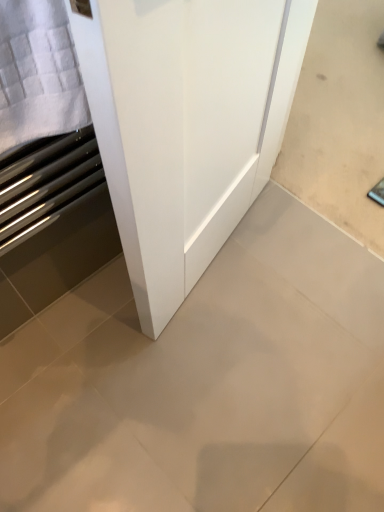
Question: From a real-world perspective, is white textured towel at left below matte gray tile at center?

Choices:
 (A) yes
 (B) no

Answer: (B)

Question: Is white textured towel at left positioned with its back to matte gray tile at center?

Choices:
 (A) yes
 (B) no

Answer: (B)

Question: Is white textured towel at left beside matte gray tile at center?

Choices:
 (A) no
 (B) yes

Answer: (A)

Question: Can you confirm if white textured towel at left is shorter than matte gray tile at center?

Choices:
 (A) yes
 (B) no

Answer: (B)

Question: Does white textured towel at left have a greater height compared to matte gray tile at center?

Choices:
 (A) yes
 (B) no

Answer: (A)

Question: Is white textured towel at left in front of matte gray tile at center?

Choices:
 (A) no
 (B) yes

Answer: (B)

Question: From a real-world perspective, is matte gray tile at center positioned over white textured towel at left based on gravity?

Choices:
 (A) yes
 (B) no

Answer: (B)

Question: From the image's perspective, does matte gray tile at center appear higher than white textured towel at left?

Choices:
 (A) yes
 (B) no

Answer: (B)

Question: Does matte gray tile at center appear on the right side of white textured towel at left?

Choices:
 (A) no
 (B) yes

Answer: (B)

Question: Considering the relative sizes of matte gray tile at center and white textured towel at left in the image provided, is matte gray tile at center bigger than white textured towel at left?

Choices:
 (A) yes
 (B) no

Answer: (A)

Question: From a real-world perspective, is matte gray tile at center located beneath white textured towel at left?

Choices:
 (A) no
 (B) yes

Answer: (B)

Question: Is matte gray tile at center with white textured towel at left?

Choices:
 (A) yes
 (B) no

Answer: (B)

Question: Is white textured towel at left taller or shorter than matte gray tile at center?

Choices:
 (A) short
 (B) tall

Answer: (B)